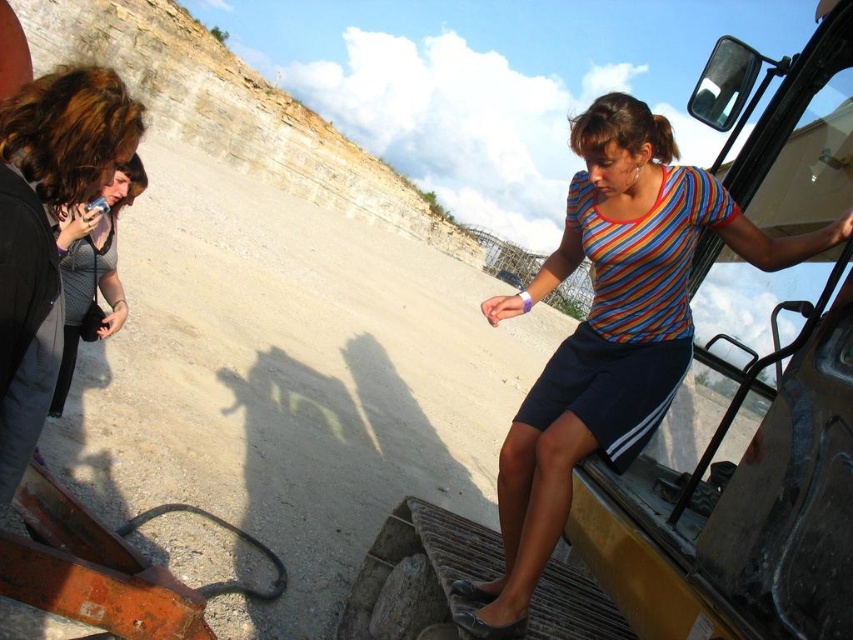
Consider the image. You are a construction worker in the quarry and need to identify which worker is closer to you based on their shirts. Which worker is in front, the matte gray shirt at left or the gray textured shirt at left?

The matte gray shirt at left is in front of the gray textured shirt at left, so the matte gray shirt at left is closer to you.

You are a construction worker standing at the base of the quarry slope. You need to hand over a tool to the person wearing the striped cotton shirt at upper right, who is operating the bulldozer. The tool is too heavy to throw. Can you walk directly to them without needing to climb the slope?

The striped cotton shirt at upper right and camera are 29.78 meters apart from each other. Since the camera is likely positioned near the observer, the distance to the striped cotton shirt at upper right is significant. However, the quarry slope is in the background, so the worker can walk around the base to reach them without climbing the slope.

You are a construction worker standing at the base of the quarry wall. You need to move a heavy tool from the striped cotton shirt at upper right to the camera. The path is clear, but you must ensure the tool won not fall. What is the minimum distance you should keep between the tool and the edge of the quarry wall to safely transport it?

The minimum distance to keep between the tool and the edge of the quarry wall should be at least 30 meters to ensure safety, as the tool is being moved over 29.78 meters between the striped cotton shirt at upper right and the camera.